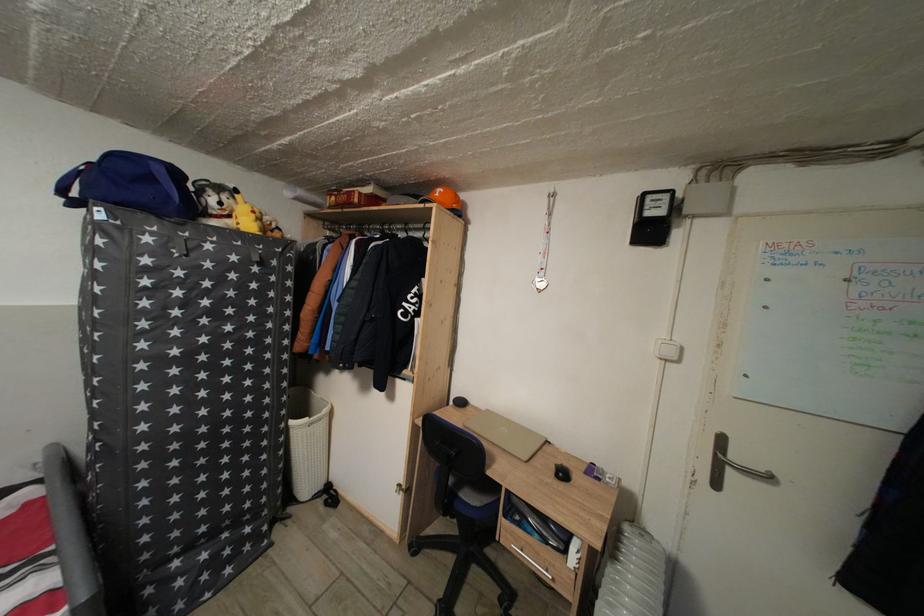
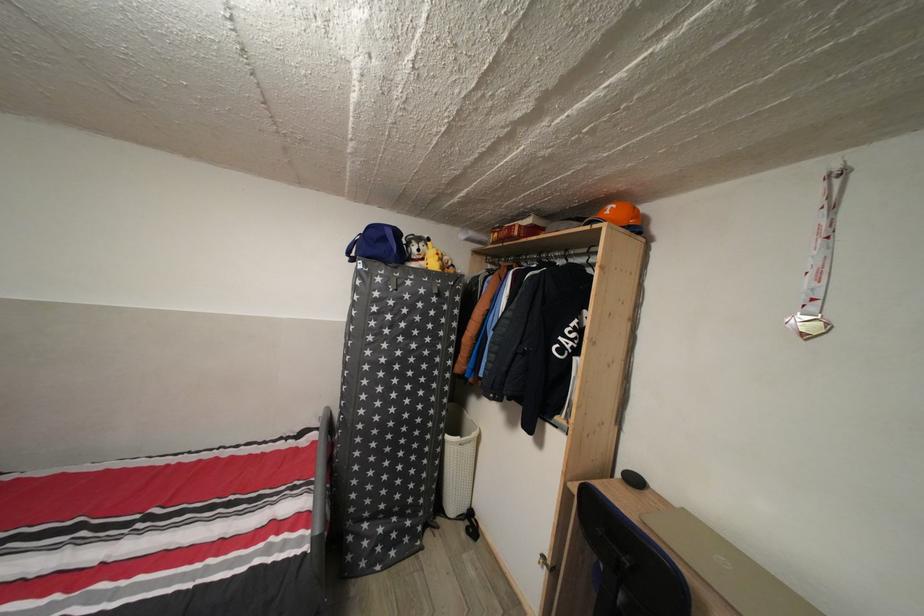
The point at (341, 205) is marked in the first image. Where is the corresponding point in the second image?

(503, 241)